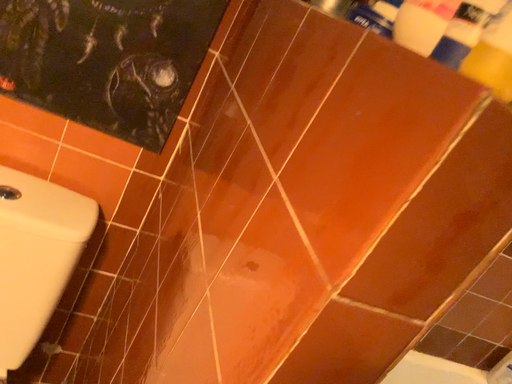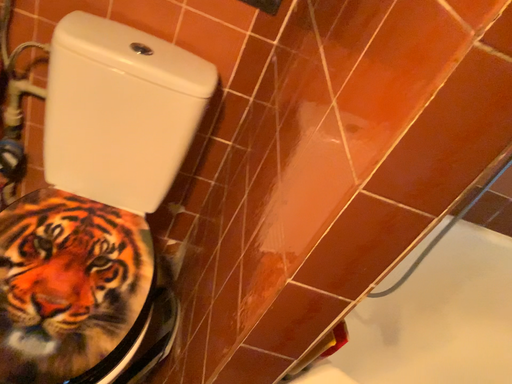
Question: How did the camera likely rotate when shooting the video?

Choices:
 (A) rotated downward
 (B) rotated upward

Answer: (A)